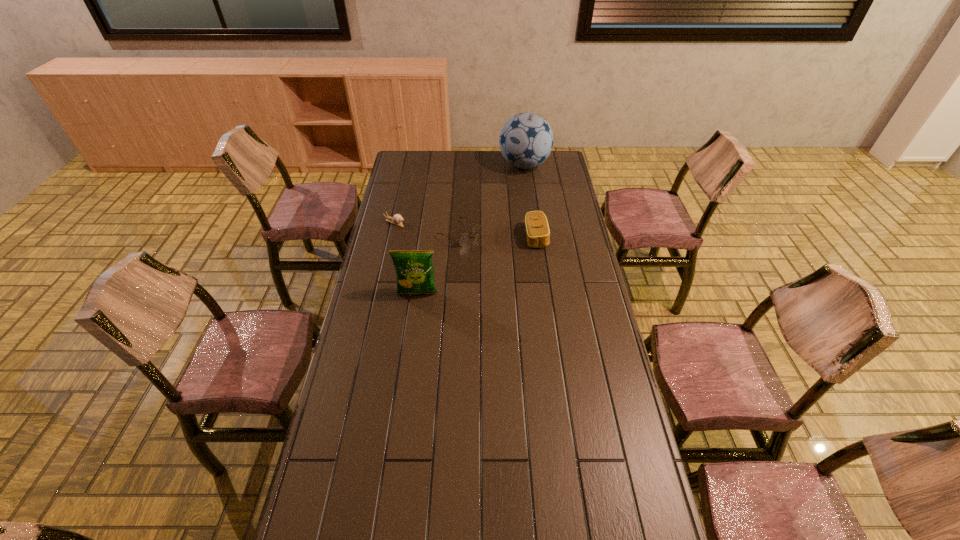
Where is `free spot between the soccer ball and the escargot`? free spot between the soccer ball and the escargot is located at coordinates (460, 194).

I want to click on free space that is in between the soccer ball and the nearest object, so click(x=470, y=229).

Locate an element on the screen. This screenshot has width=960, height=540. vacant area between the farthest object and the shortest object is located at coordinates (460, 194).

What are the coordinates of `vacant space that is in between the clutch bag and the sunglasses` in the screenshot? It's located at (497, 235).

Identify the location of free space between the leftmost object and the soccer ball. This screenshot has height=540, width=960. (460, 194).

Find the location of a particular element. This screenshot has height=540, width=960. free space between the clutch bag and the soccer ball is located at coordinates (530, 201).

At what (x,y) coordinates should I click in order to perform the action: click on vacant space in between the shortest object and the tallest object. Please return your answer as a coordinate pair (x, y). Looking at the image, I should click on (460, 194).

This screenshot has height=540, width=960. In order to click on blank region between the soccer ball and the sunglasses in this screenshot , I will do `click(492, 200)`.

At what (x,y) coordinates should I click in order to perform the action: click on object that is the fourth closest to the third shortest object. Please return your answer as a coordinate pair (x, y). Image resolution: width=960 pixels, height=540 pixels. Looking at the image, I should click on (397, 219).

I want to click on object that is the fourth closest one to the tallest object, so click(x=415, y=275).